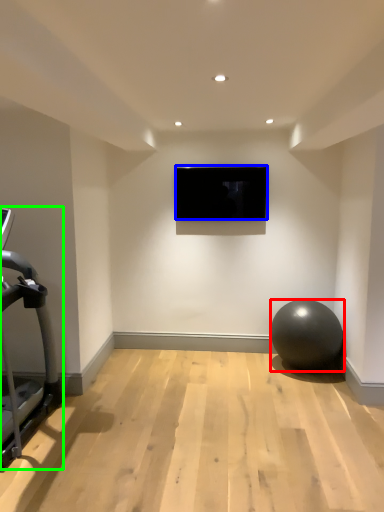
Question: Which is farther away from ball (highlighted by a red box)? television (highlighted by a blue box) or treadmill (highlighted by a green box)?

Choices:
 (A) television
 (B) treadmill

Answer: (B)